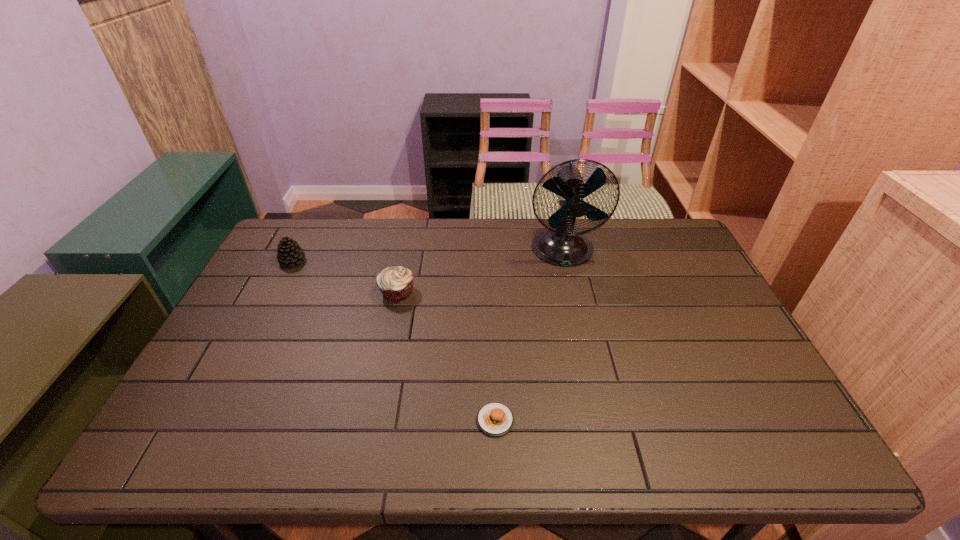
Where is `free location located on the back of the shortest object`? The image size is (960, 540). free location located on the back of the shortest object is located at coordinates (492, 318).

You are a GUI agent. You are given a task and a screenshot of the screen. Output one action in this format:
    pyautogui.click(x=<x>, y=<y>)
    Task: Click on the fan at the far edge
    This screenshot has height=540, width=960.
    Given the screenshot: What is the action you would take?
    [561, 246]

Find the location of a particular element. The width and height of the screenshot is (960, 540). pinecone present at the far edge is located at coordinates (290, 253).

Identify the location of object located in the near edge section of the desktop. The width and height of the screenshot is (960, 540). (494, 419).

Identify the location of object located at the left edge. The image size is (960, 540). (290, 253).

Image resolution: width=960 pixels, height=540 pixels. In order to click on object that is positioned at the far left corner in this screenshot , I will do `click(290, 253)`.

At what (x,y) coordinates should I click in order to perform the action: click on vacant area at the far edge of the desktop. Please return your answer as a coordinate pair (x, y). The height and width of the screenshot is (540, 960). Looking at the image, I should click on (459, 232).

In the image, there is a desktop. Where is `vacant space at the left edge`? vacant space at the left edge is located at coordinates (299, 268).

Find the location of a particular element. vacant area at the right edge is located at coordinates (762, 409).

Where is `vacant space at the near left corner of the desktop`? vacant space at the near left corner of the desktop is located at coordinates (189, 434).